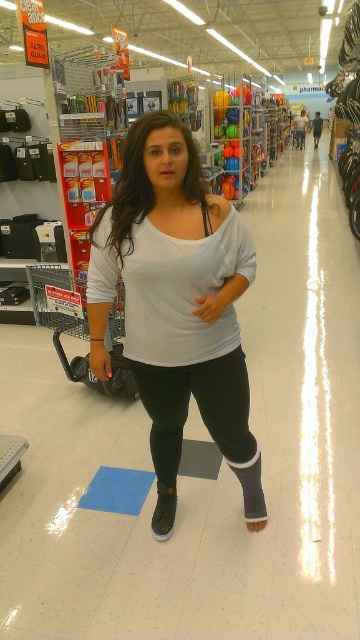
You are a store employee at Walmart who needs to ensure that the distance between the white matte shirt at center and the black matte leggings at center is at least 6 inches to comply with new safety regulations. Based on the image provided, is the current distance compliant?

The white matte shirt at center is only 5.59 inches from the black matte leggings at center, which is less than the required 6 inches. Therefore, the current distance does not comply with the new safety regulations.

You are a store employee at Walmart and need to ensure customer safety. You notice a customer wearing a white matte shirt at center and black matte leggings at center. Based on their clothing, can you determine if their right leg is visible and if they might need assistance due to the leg brace mentioned in the scene description?

The white matte shirt at center is to the left of black matte leggings at center. Since the leg brace is on the right leg, which is extended forward, the right leg is visible under the leggings. The customer may need assistance due to the leg brace, so it is advisable to offer help.

You are a customer in a Walmart store and you see two points marked on the floor. The first point is at coordinate point (x=159, y=324) and the second is at point (x=246, y=465). Which point is closer to you if you are facing the shelves?

Point (x=159, y=324) is in front of point (x=246, y=465), so it is closer to you.